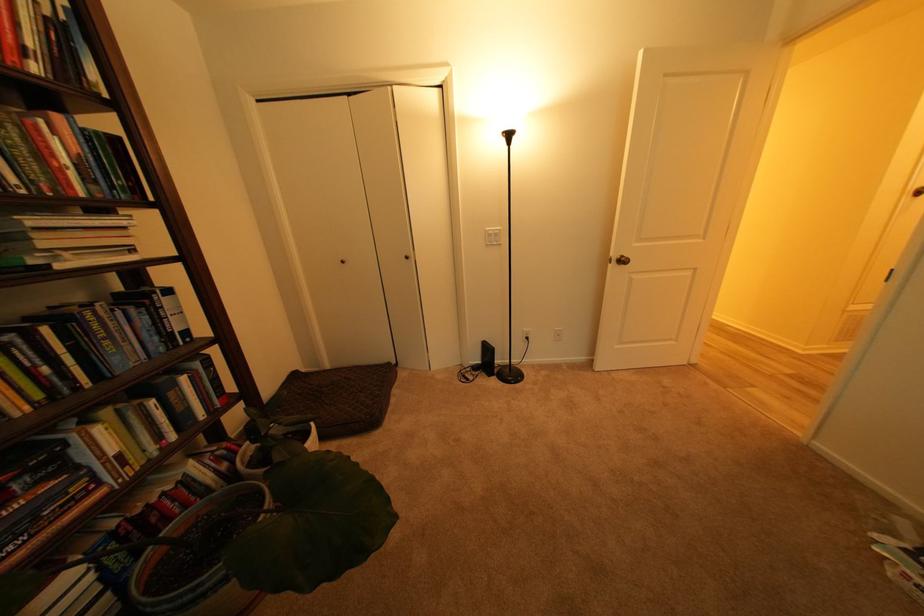
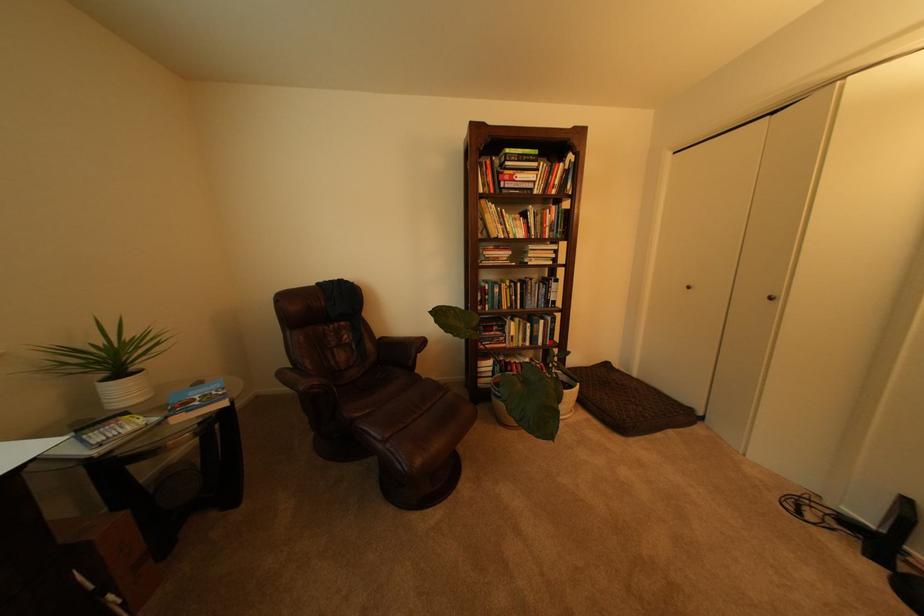
The point at (x=122, y=326) is marked in the first image. Where is the corresponding point in the second image?

(543, 290)